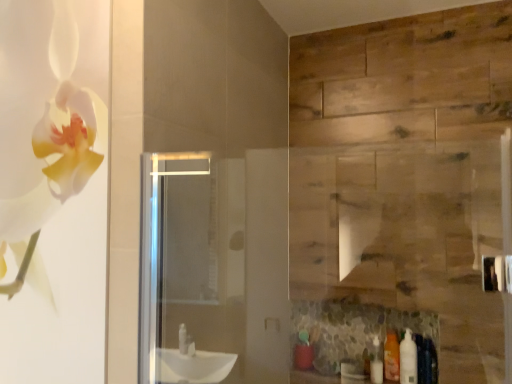
I want to click on white matte flower at left, so tap(42, 124).

What do you see at coordinates (42, 124) in the screenshot?
I see `white matte flower at left` at bounding box center [42, 124].

At what (x,y) coordinates should I click in order to perform the action: click on white matte flower at left. Please return your answer as a coordinate pair (x, y). The width and height of the screenshot is (512, 384). Looking at the image, I should click on (42, 124).